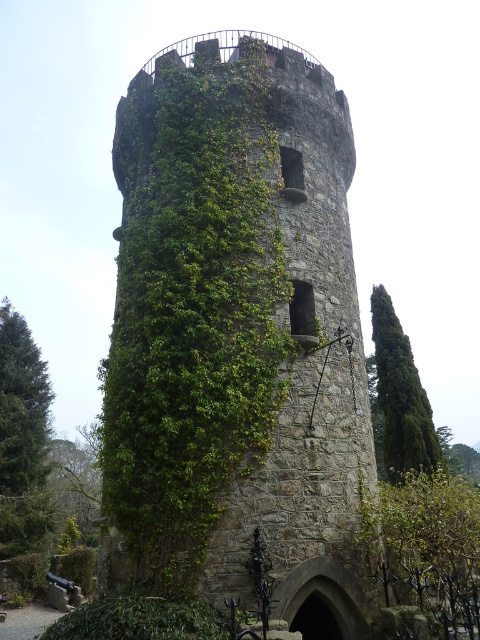
Question: Is the position of green stone tower at center more distant than that of green leafy tree at left?

Choices:
 (A) no
 (B) yes

Answer: (A)

Question: Which object appears farthest from the camera in this image?

Choices:
 (A) green leafy tree at left
 (B) green leafy tree at right
 (C) green stone tower at center

Answer: (A)

Question: Can you confirm if green stone tower at center is smaller than green leafy bush at lower right?

Choices:
 (A) yes
 (B) no

Answer: (B)

Question: Estimate the real-world distances between objects in this image. Which object is farther from the green leafy bush at lower right?

Choices:
 (A) green leafy tree at right
 (B) green stone tower at center
 (C) green leafy tree at left

Answer: (C)

Question: Which of the following is the closest to the observer?

Choices:
 (A) (222, 340)
 (B) (450, 637)
 (C) (0, 499)
 (D) (408, 444)

Answer: (B)

Question: Can you confirm if green stone tower at center is wider than green leafy tree at right?

Choices:
 (A) no
 (B) yes

Answer: (B)